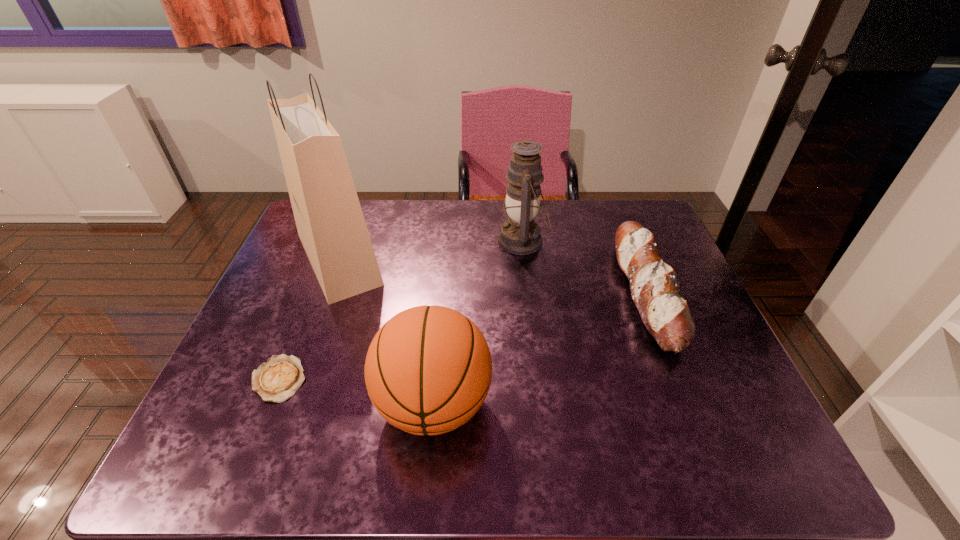
Identify the location of object that is at the far left corner. The image size is (960, 540). (330, 223).

Identify the location of object present at the far right corner. 654,289.

In the image, there is a desktop. Find the location of `vacant area at the far edge`. vacant area at the far edge is located at coordinates (393, 227).

Locate an element on the screen. vacant space at the near edge is located at coordinates (465, 446).

Image resolution: width=960 pixels, height=540 pixels. In order to click on vacant space at the left edge of the desktop in this screenshot , I will do click(270, 294).

Find the location of `vacant point at the right edge`. vacant point at the right edge is located at coordinates (682, 277).

Locate an element on the screen. Image resolution: width=960 pixels, height=540 pixels. vacant space in between the baguet and the tallest object is located at coordinates (492, 276).

Where is `vacant region between the rightmost object and the tallest object`? This screenshot has width=960, height=540. vacant region between the rightmost object and the tallest object is located at coordinates (492, 276).

Find the location of a particular element. free space between the quiche and the oil lamp is located at coordinates (400, 310).

The height and width of the screenshot is (540, 960). In order to click on free space between the second object from right to left and the tallest object in this screenshot , I will do `click(431, 250)`.